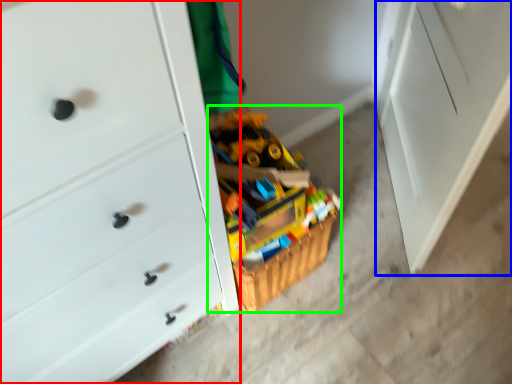
Question: Based on their relative distances, which object is nearer to chest of drawers (highlighted by a red box)? Choose from file cabinet (highlighted by a blue box) and toy (highlighted by a green box).

Choices:
 (A) file cabinet
 (B) toy

Answer: (B)